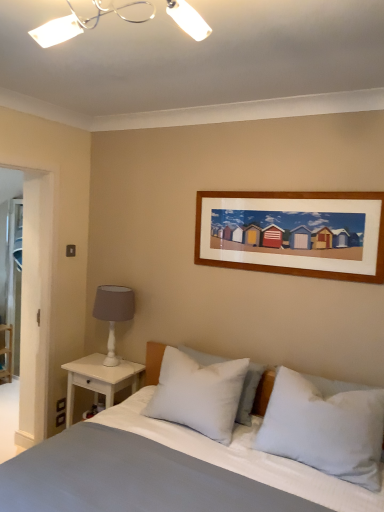
Question: Does smooth cotton bed at center have a smaller size compared to white wood nightstand at left?

Choices:
 (A) yes
 (B) no

Answer: (B)

Question: From the image's perspective, is smooth cotton bed at center beneath white wood nightstand at left?

Choices:
 (A) no
 (B) yes

Answer: (B)

Question: Considering the relative sizes of smooth cotton bed at center and white wood nightstand at left in the image provided, is smooth cotton bed at center shorter than white wood nightstand at left?

Choices:
 (A) no
 (B) yes

Answer: (A)

Question: Can you confirm if smooth cotton bed at center is wider than white wood nightstand at left?

Choices:
 (A) no
 (B) yes

Answer: (B)

Question: Is there a large distance between smooth cotton bed at center and white wood nightstand at left?

Choices:
 (A) no
 (B) yes

Answer: (A)

Question: Relative to white matte table lamp at left, is smooth cotton bed at center in front or behind?

Choices:
 (A) front
 (B) behind

Answer: (A)

Question: Considering the positions of point (215, 478) and point (114, 317), is point (215, 478) closer or farther from the camera than point (114, 317)?

Choices:
 (A) closer
 (B) farther

Answer: (A)

Question: Based on their sizes in the image, would you say smooth cotton bed at center is bigger or smaller than white matte table lamp at left?

Choices:
 (A) big
 (B) small

Answer: (A)

Question: In terms of width, does smooth cotton bed at center look wider or thinner when compared to white matte table lamp at left?

Choices:
 (A) thin
 (B) wide

Answer: (B)

Question: Is white soft pillow at center, the 2th pillow from the right, bigger or smaller than white plastic light fixture at upper center?

Choices:
 (A) small
 (B) big

Answer: (B)

Question: Based on their positions, is white soft pillow at center, the 2th pillow from the left, located to the left or right of white plastic light fixture at upper center?

Choices:
 (A) right
 (B) left

Answer: (A)

Question: Is white soft pillow at center, the 2th pillow from the right, inside the boundaries of white plastic light fixture at upper center, or outside?

Choices:
 (A) outside
 (B) inside

Answer: (A)

Question: From a real-world perspective, relative to white plastic light fixture at upper center, is white soft pillow at center, the 2th pillow from the left, vertically above or below?

Choices:
 (A) above
 (B) below

Answer: (B)

Question: Is white matte table lamp at left situated inside white plastic light fixture at upper center or outside?

Choices:
 (A) outside
 (B) inside

Answer: (A)

Question: Looking at their shapes, would you say white matte table lamp at left is wider or thinner than white plastic light fixture at upper center?

Choices:
 (A) thin
 (B) wide

Answer: (A)